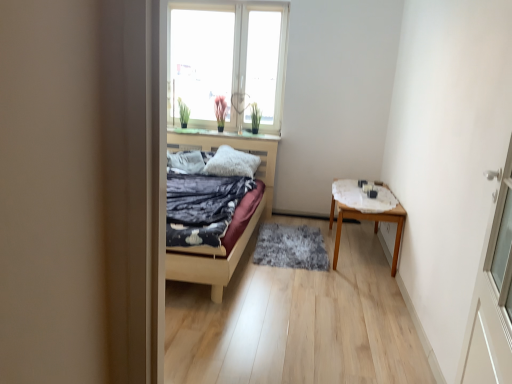
Question: Is white fluffy pillow at center, arranged as the 1th pillow when viewed from the right, positioned behind wooden table at right?

Choices:
 (A) yes
 (B) no

Answer: (A)

Question: Does white fluffy pillow at center, arranged as the 1th pillow when viewed from the right, have a greater width compared to wooden table at right?

Choices:
 (A) yes
 (B) no

Answer: (B)

Question: Is white fluffy pillow at center, arranged as the 1th pillow when viewed from the right, thinner than wooden table at right?

Choices:
 (A) yes
 (B) no

Answer: (A)

Question: From a real-world perspective, is white fluffy pillow at center, arranged as the 1th pillow when viewed from the right, under wooden table at right?

Choices:
 (A) no
 (B) yes

Answer: (A)

Question: Is white fluffy pillow at center, positioned as the 2th pillow in left-to-right order, far away from wooden table at right?

Choices:
 (A) yes
 (B) no

Answer: (A)

Question: Is white fluffy pillow at center, arranged as the 1th pillow when viewed from the right, smaller than wooden table at right?

Choices:
 (A) yes
 (B) no

Answer: (A)

Question: From a real-world perspective, is gray shaggy rug at center positioned under white glossy window sill at upper center based on gravity?

Choices:
 (A) no
 (B) yes

Answer: (B)

Question: Does gray shaggy rug at center turn towards white glossy window sill at upper center?

Choices:
 (A) yes
 (B) no

Answer: (B)

Question: From a real-world perspective, does gray shaggy rug at center stand above white glossy window sill at upper center?

Choices:
 (A) yes
 (B) no

Answer: (B)

Question: Can you confirm if gray shaggy rug at center is wider than white glossy window sill at upper center?

Choices:
 (A) yes
 (B) no

Answer: (A)

Question: Considering the relative sizes of gray shaggy rug at center and white glossy window sill at upper center in the image provided, is gray shaggy rug at center shorter than white glossy window sill at upper center?

Choices:
 (A) yes
 (B) no

Answer: (B)

Question: Is gray shaggy rug at center not close to white glossy window sill at upper center?

Choices:
 (A) yes
 (B) no

Answer: (A)

Question: From a real-world perspective, does gray shaggy rug at center sit lower than white textured table at right?

Choices:
 (A) no
 (B) yes

Answer: (B)